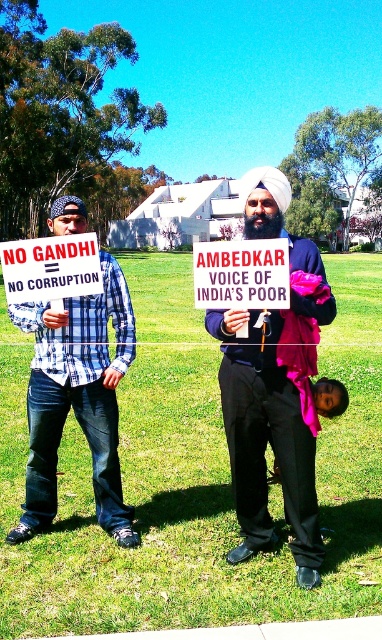
Question: Which object is the farthest from the white paper sign at center?

Choices:
 (A) blue plaid shirt at left
 (B) pink fabric at lower center
 (C) cardboard sign at center
 (D) dark blue fabric turban at center

Answer: (B)

Question: Does dark blue fabric turban at center appear under cardboard sign at center?

Choices:
 (A) no
 (B) yes

Answer: (B)

Question: Can you confirm if dark blue fabric turban at center is positioned to the left of blue plaid shirt at left?

Choices:
 (A) yes
 (B) no

Answer: (B)

Question: Which point is closer to the camera?

Choices:
 (A) dark blue fabric turban at center
 (B) cardboard sign at center

Answer: (A)

Question: Is dark blue fabric turban at center smaller than blue plaid shirt at left?

Choices:
 (A) yes
 (B) no

Answer: (B)

Question: Which of the following is the farthest from the observer?

Choices:
 (A) (40, 243)
 (B) (194, 275)
 (C) (314, 385)
 (D) (302, 262)

Answer: (B)